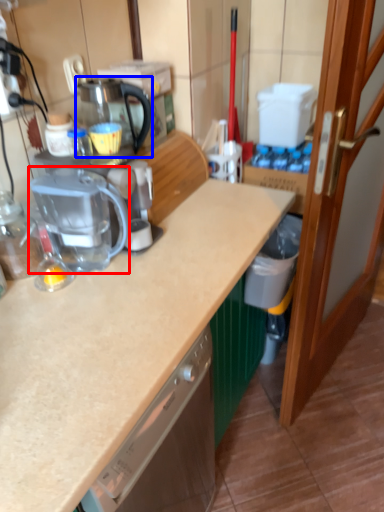
Question: Which of the following is the closest to the observer, kitchen appliance (highlighted by a red box) or coffeepot (highlighted by a blue box)?

Choices:
 (A) kitchen appliance
 (B) coffeepot

Answer: (A)